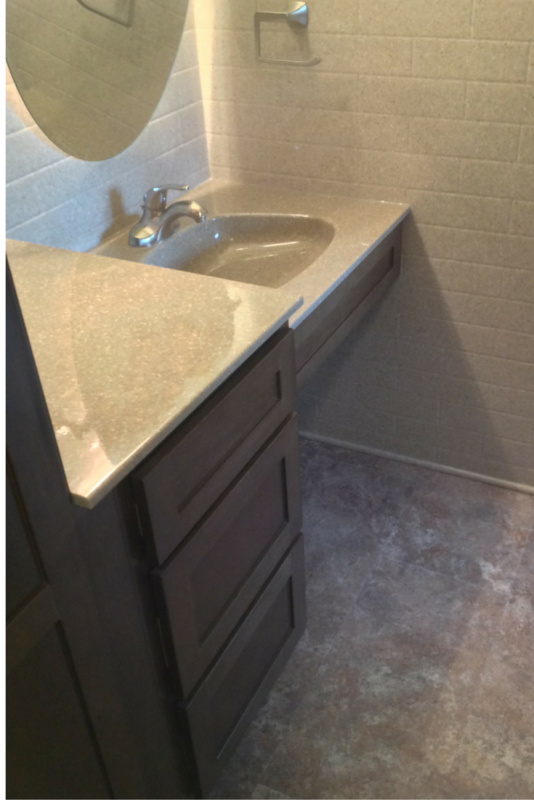
What are the coordinates of `grout` in the screenshot? It's located at (25, 222).